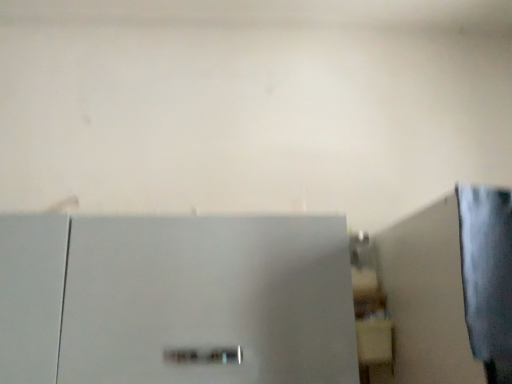
Question: From a real-world perspective, is satin silver refrigerator at center above or below matte white shelf at center-right?

Choices:
 (A) below
 (B) above

Answer: (A)

Question: Does point (5, 243) appear closer or farther from the camera than point (368, 314)?

Choices:
 (A) farther
 (B) closer

Answer: (B)

Question: Looking at their shapes, would you say satin silver refrigerator at center is wider or thinner than matte white shelf at center-right?

Choices:
 (A) thin
 (B) wide

Answer: (B)

Question: From the image's perspective, relative to satin silver refrigerator at center, is matte white shelf at center-right above or below?

Choices:
 (A) below
 (B) above

Answer: (B)

Question: Is matte white shelf at center-right taller or shorter than satin silver refrigerator at center?

Choices:
 (A) tall
 (B) short

Answer: (B)

Question: Is matte white shelf at center-right inside or outside of satin silver refrigerator at center?

Choices:
 (A) inside
 (B) outside

Answer: (B)

Question: Would you say matte white shelf at center-right is to the left or to the right of satin silver refrigerator at center in the picture?

Choices:
 (A) left
 (B) right

Answer: (B)